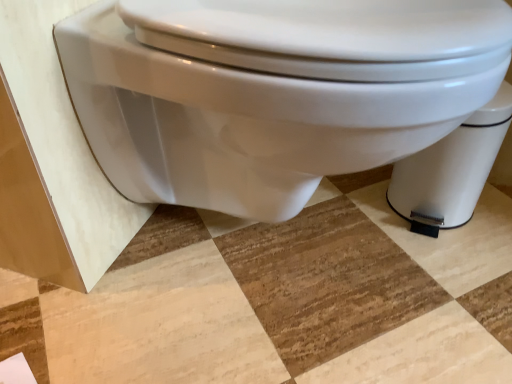
Question: Could you tell me if white glossy toilet at center is turned towards white glossy toilet bowl at lower right?

Choices:
 (A) yes
 (B) no

Answer: (B)

Question: From the image's perspective, is white glossy toilet at center located beneath white glossy toilet bowl at lower right?

Choices:
 (A) no
 (B) yes

Answer: (A)

Question: Considering the relative sizes of white glossy toilet at center and white glossy toilet bowl at lower right in the image provided, is white glossy toilet at center wider than white glossy toilet bowl at lower right?

Choices:
 (A) yes
 (B) no

Answer: (A)

Question: Can you confirm if white glossy toilet at center is thinner than white glossy toilet bowl at lower right?

Choices:
 (A) yes
 (B) no

Answer: (B)

Question: Is white glossy toilet at center bigger than white glossy toilet bowl at lower right?

Choices:
 (A) yes
 (B) no

Answer: (A)

Question: Does white glossy toilet at center have a lesser height compared to white glossy toilet bowl at lower right?

Choices:
 (A) yes
 (B) no

Answer: (B)

Question: Is white glossy toilet bowl at lower right to the left of white glossy toilet at center from the viewer's perspective?

Choices:
 (A) yes
 (B) no

Answer: (B)

Question: Is white glossy toilet bowl at lower right positioned behind white glossy toilet at center?

Choices:
 (A) yes
 (B) no

Answer: (A)

Question: Is white glossy toilet bowl at lower right far away from white glossy toilet at center?

Choices:
 (A) yes
 (B) no

Answer: (B)

Question: Is white glossy toilet bowl at lower right looking in the opposite direction of white glossy toilet at center?

Choices:
 (A) no
 (B) yes

Answer: (A)

Question: Can you confirm if white glossy toilet bowl at lower right is wider than white glossy toilet at center?

Choices:
 (A) no
 (B) yes

Answer: (A)

Question: From a real-world perspective, is white glossy toilet bowl at lower right positioned over white glossy toilet at center based on gravity?

Choices:
 (A) no
 (B) yes

Answer: (A)

Question: Looking at their shapes, would you say white glossy toilet at center is wider or thinner than white glossy toilet bowl at lower right?

Choices:
 (A) thin
 (B) wide

Answer: (B)